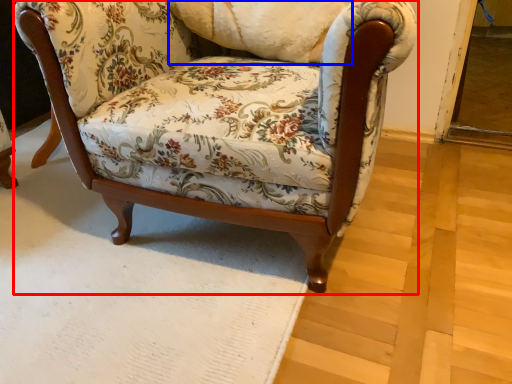
Question: Which object appears closest to the camera in this image, chair (highlighted by a red box) or pillow (highlighted by a blue box)?

Choices:
 (A) chair
 (B) pillow

Answer: (A)